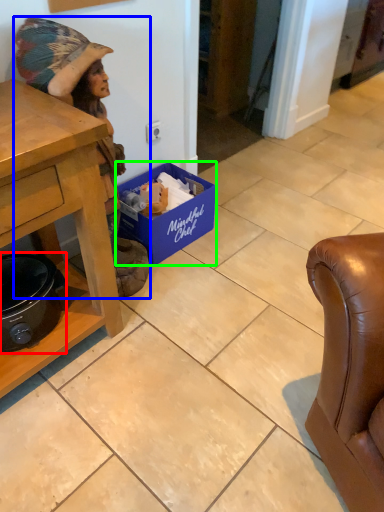
Question: Which object is positioned closest to appliance (highlighted by a red box)? Select from person (highlighted by a blue box) and box (highlighted by a green box).

Choices:
 (A) person
 (B) box

Answer: (A)